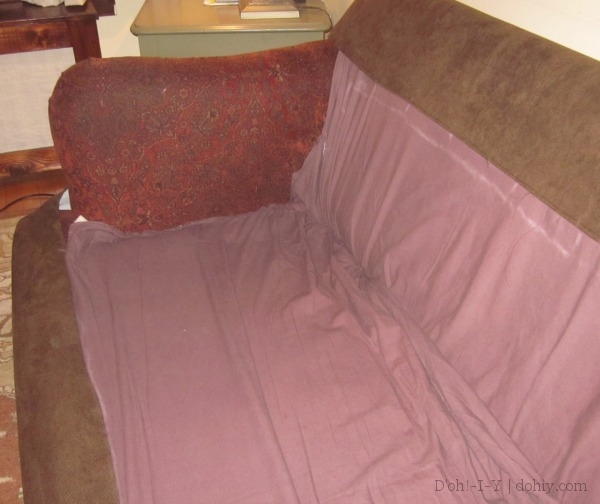
Find the location of a particular element. couch cover is located at coordinates (234, 315), (445, 197).